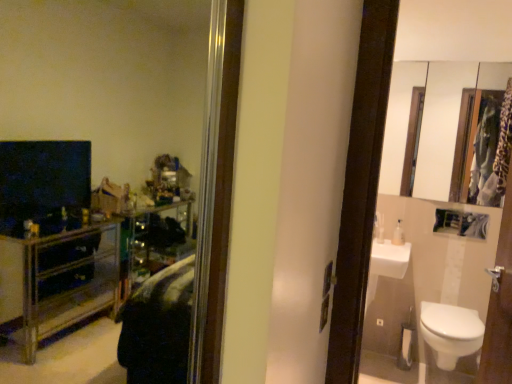
Question: Considering the positions of white glossy mirror at upper right and clear plastic bottle at right in the image, is white glossy mirror at upper right wider or thinner than clear plastic bottle at right?

Choices:
 (A) thin
 (B) wide

Answer: (A)

Question: Considering the positions of point (411, 72) and point (402, 241), is point (411, 72) closer or farther from the camera than point (402, 241)?

Choices:
 (A) farther
 (B) closer

Answer: (A)

Question: Considering the real-world distances, which object is farthest from the white glossy toilet at lower right?

Choices:
 (A) white glossy mirror at upper right
 (B) clear plastic bottle at right

Answer: (A)

Question: Considering the real-world distances, which object is closest to the white glossy mirror at upper right?

Choices:
 (A) clear plastic bottle at right
 (B) white glossy toilet at lower right

Answer: (A)